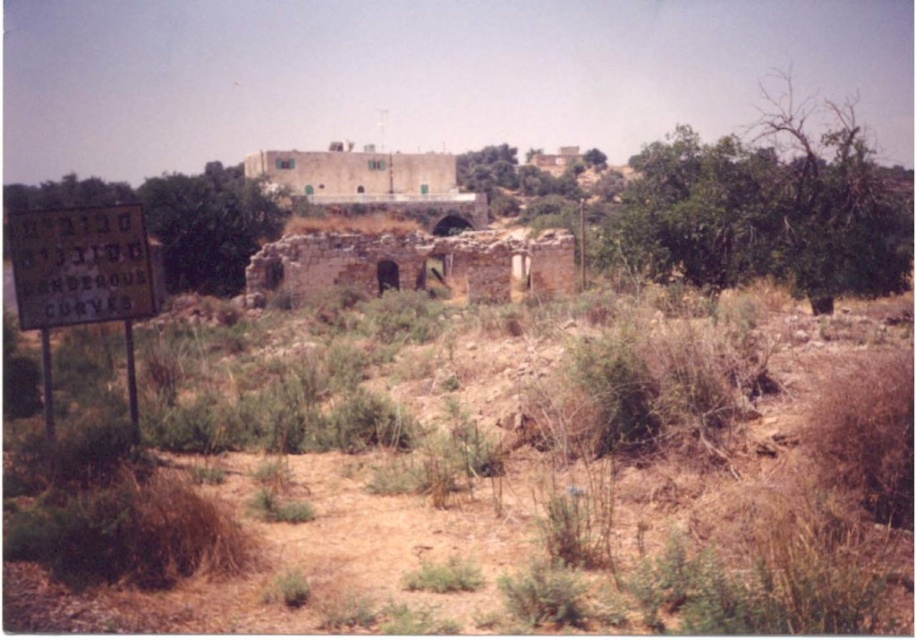
You are standing at the signpost with yellow text on a dark background and want to step onto the brown dry grass at lower center. Based on its coordinates, is the grass located to your front, back, left, or right?

The brown dry grass at lower center is located at point (487, 483), which means it is positioned to your front when facing the signpost.

You are a hiker who wants to place a small marker between the brown dry grass at lower center and the yellow paper sign at left. Since the marker is 10 cm wide, will it fit between them without overlapping either object?

The brown dry grass at lower center has a larger size compared to yellow paper sign at left. Since the marker is only 10 cm wide, it should fit between them without overlapping either object as there is enough space between the two objects.